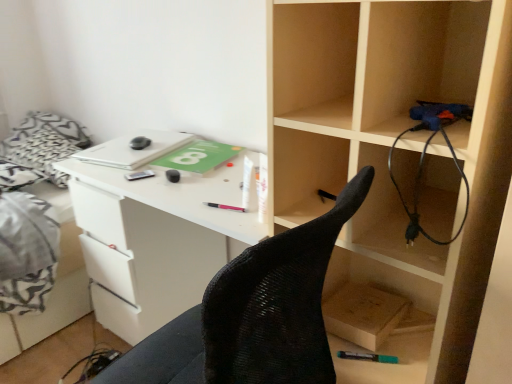
Locate an element on the screen. vacant area that lies in front of pink plastic pen at center, the second stationery viewed from the front is located at coordinates (229, 221).